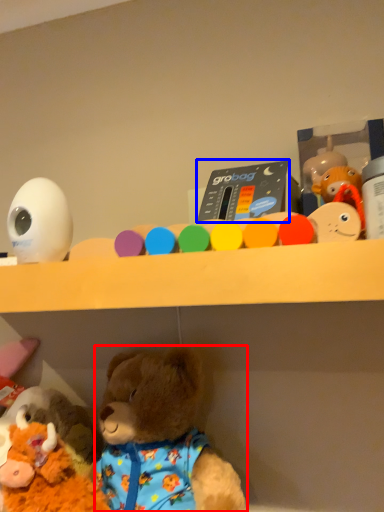
Question: Which of the following is the closest to the observer, teddy bear (highlighted by a red box) or toy (highlighted by a blue box)?

Choices:
 (A) teddy bear
 (B) toy

Answer: (A)